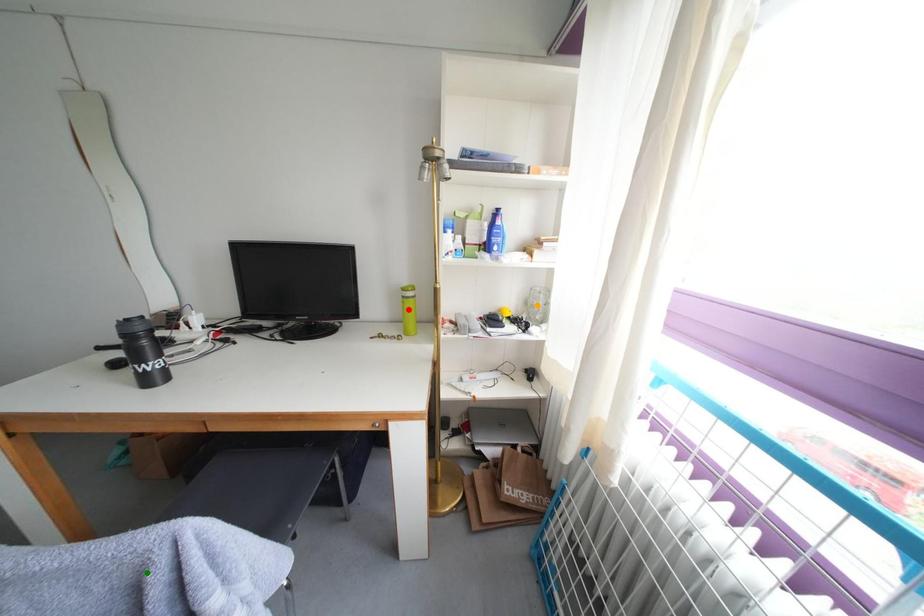
Order these from nearest to farthest:
red point | orange point | green point

orange point, red point, green point